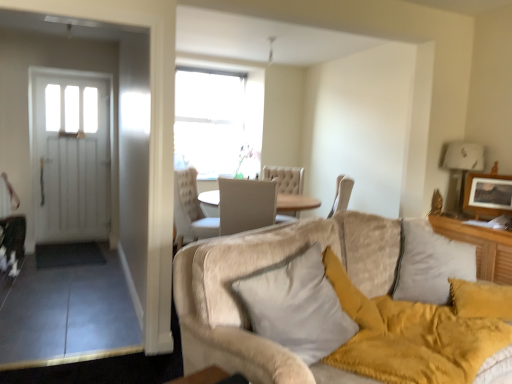
Question: Can you confirm if wooden picture frame at upper right is taller than beige plush couch at lower right?

Choices:
 (A) yes
 (B) no

Answer: (A)

Question: Is wooden picture frame at upper right to the left of beige plush couch at lower right from the viewer's perspective?

Choices:
 (A) no
 (B) yes

Answer: (A)

Question: Is wooden picture frame at upper right aimed at beige plush couch at lower right?

Choices:
 (A) no
 (B) yes

Answer: (A)

Question: From a real-world perspective, is wooden picture frame at upper right below beige plush couch at lower right?

Choices:
 (A) yes
 (B) no

Answer: (B)

Question: Does wooden picture frame at upper right come behind beige plush couch at lower right?

Choices:
 (A) no
 (B) yes

Answer: (B)

Question: Do you think beige plush couch at lower right is within white soft pillow at center, or outside of it?

Choices:
 (A) outside
 (B) inside

Answer: (A)

Question: Considering the positions of beige plush couch at lower right and white soft pillow at center in the image, is beige plush couch at lower right taller or shorter than white soft pillow at center?

Choices:
 (A) tall
 (B) short

Answer: (B)

Question: From the image's perspective, relative to white soft pillow at center, is beige plush couch at lower right above or below?

Choices:
 (A) below
 (B) above

Answer: (A)

Question: From a real-world perspective, relative to white soft pillow at center, is beige plush couch at lower right vertically above or below?

Choices:
 (A) below
 (B) above

Answer: (A)

Question: In terms of width, does wooden picture frame at upper right look wider or thinner when compared to beige plush couch at lower right?

Choices:
 (A) thin
 (B) wide

Answer: (A)

Question: Visually, is wooden picture frame at upper right positioned to the left or to the right of beige plush couch at lower right?

Choices:
 (A) left
 (B) right

Answer: (B)

Question: From their relative heights in the image, would you say wooden picture frame at upper right is taller or shorter than beige plush couch at lower right?

Choices:
 (A) short
 (B) tall

Answer: (B)

Question: In terms of size, does wooden picture frame at upper right appear bigger or smaller than beige plush couch at lower right?

Choices:
 (A) big
 (B) small

Answer: (B)

Question: Is white soft pillow at center to the left or to the right of wooden picture frame at upper right in the image?

Choices:
 (A) right
 (B) left

Answer: (B)

Question: Is white soft pillow at center taller or shorter than wooden picture frame at upper right?

Choices:
 (A) short
 (B) tall

Answer: (B)